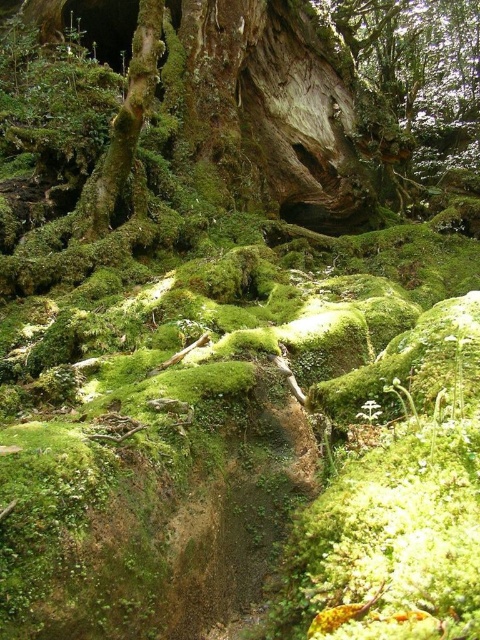
Is rough bark tree trunk at center positioned at the back of green mossy tree trunk at upper left?

Yes, rough bark tree trunk at center is further from the viewer.

What do you see at coordinates (269, 116) in the screenshot? The width and height of the screenshot is (480, 640). I see `rough bark tree trunk at center` at bounding box center [269, 116].

Is point (294, 38) positioned before point (157, 32)?

That is False.

Locate an element on the screen. This screenshot has height=640, width=480. rough bark tree trunk at center is located at coordinates (269, 116).